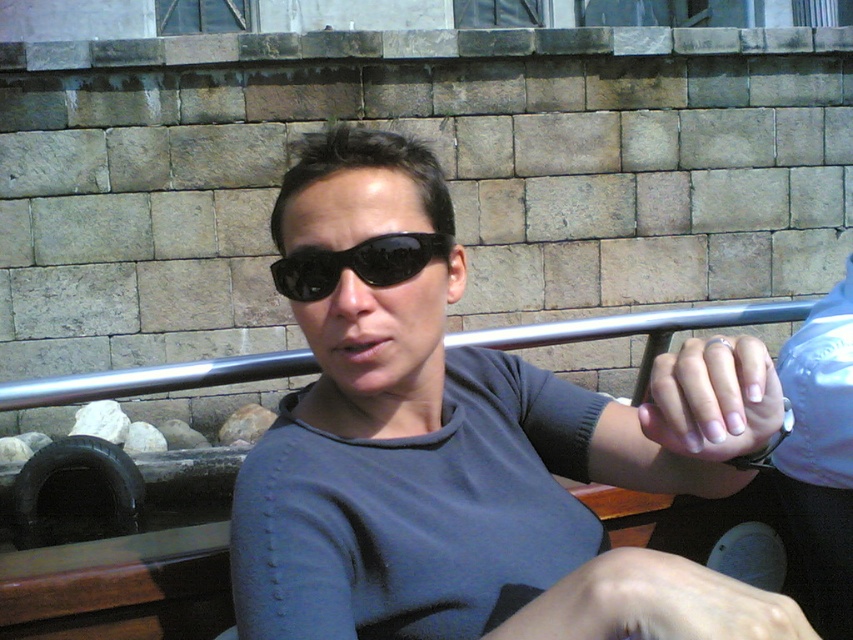
Who is more forward, (x=711, y=588) or (x=718, y=400)?

Point (x=711, y=588) is in front.

Locate an element on the screen. The width and height of the screenshot is (853, 640). pale skin at lower right is located at coordinates (653, 604).

Can you confirm if pale skin at lower right is wider than black matte sunglasses at center?

Yes.

Does pale skin at lower right have a lesser height compared to black matte sunglasses at center?

Incorrect, pale skin at lower right's height does not fall short of black matte sunglasses at center's.

What do you see at coordinates (653, 604) in the screenshot? The image size is (853, 640). I see `pale skin at lower right` at bounding box center [653, 604].

Where is `pale skin at lower right`? pale skin at lower right is located at coordinates (653, 604).

Does matte black sunglasses at center lie in front of pale skin at lower right?

No, it is not.

This screenshot has width=853, height=640. What do you see at coordinates (469, 452) in the screenshot?
I see `matte black sunglasses at center` at bounding box center [469, 452].

Describe the element at coordinates (469, 452) in the screenshot. This screenshot has height=640, width=853. I see `matte black sunglasses at center` at that location.

The height and width of the screenshot is (640, 853). Find the location of `matte black sunglasses at center`. matte black sunglasses at center is located at coordinates (469, 452).